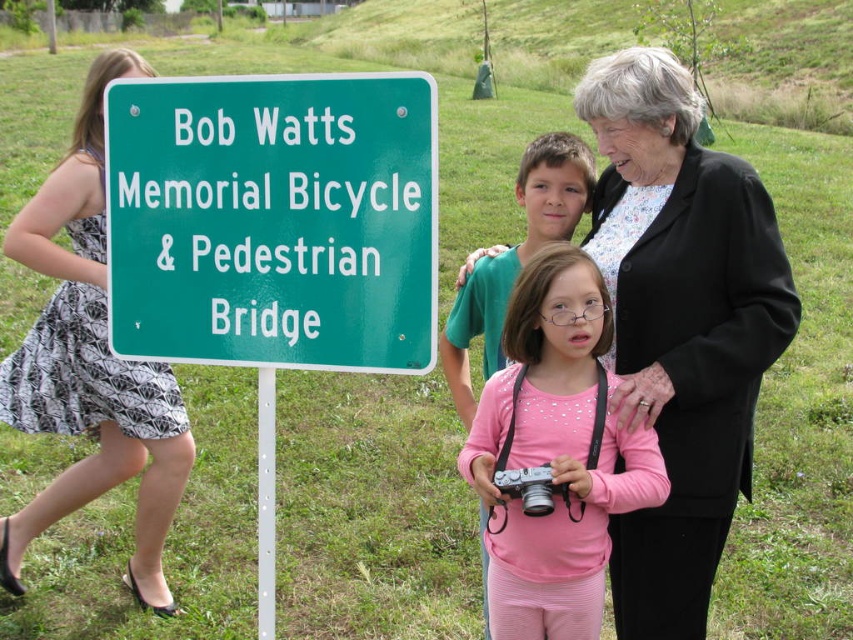
Question: Among these objects, which one is farthest from the camera?

Choices:
 (A) green metallic sign at left
 (B) pink fabric shirt at center

Answer: (B)

Question: Which object is farther from the camera taking this photo?

Choices:
 (A) silver metallic camera at center
 (B) pink fabric shirt at center
 (C) black textured blazer at upper right
 (D) green metallic sign at left

Answer: (C)

Question: From the image, what is the correct spatial relationship of green metallic sign at left in relation to pink fabric shirt at center?

Choices:
 (A) below
 (B) above

Answer: (B)

Question: Is black textured blazer at upper right smaller than pink fabric shirt at center?

Choices:
 (A) no
 (B) yes

Answer: (A)

Question: Can you confirm if green metallic sign at left is positioned below silver metallic camera at center?

Choices:
 (A) no
 (B) yes

Answer: (A)

Question: Which is farther from the black textured blazer at upper right?

Choices:
 (A) silver metallic camera at center
 (B) green metallic sign at left

Answer: (B)